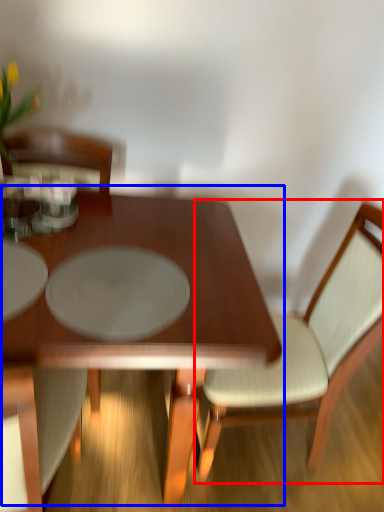
Question: Which point is further to the camera, chair (highlighted by a red box) or coffee table (highlighted by a blue box)?

Choices:
 (A) chair
 (B) coffee table

Answer: (A)